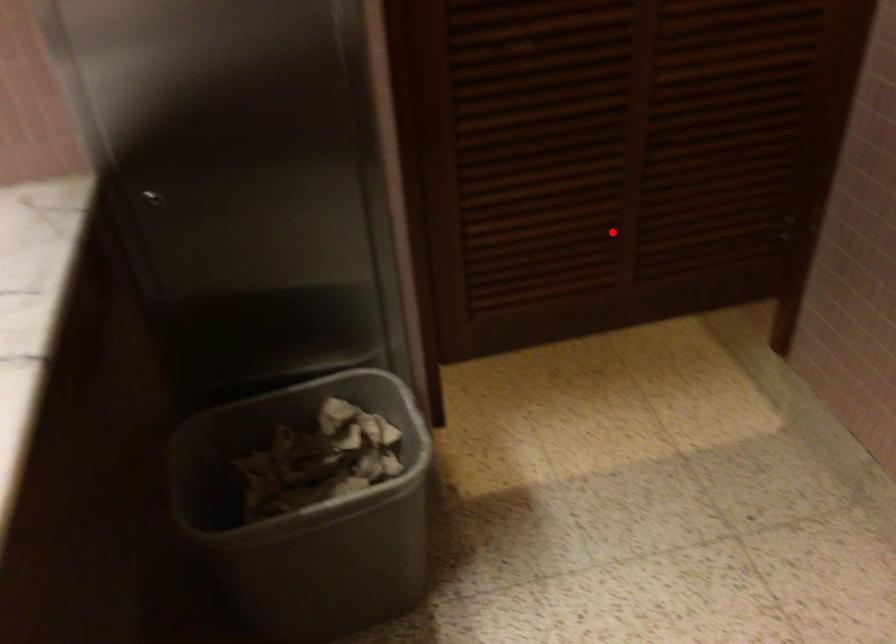
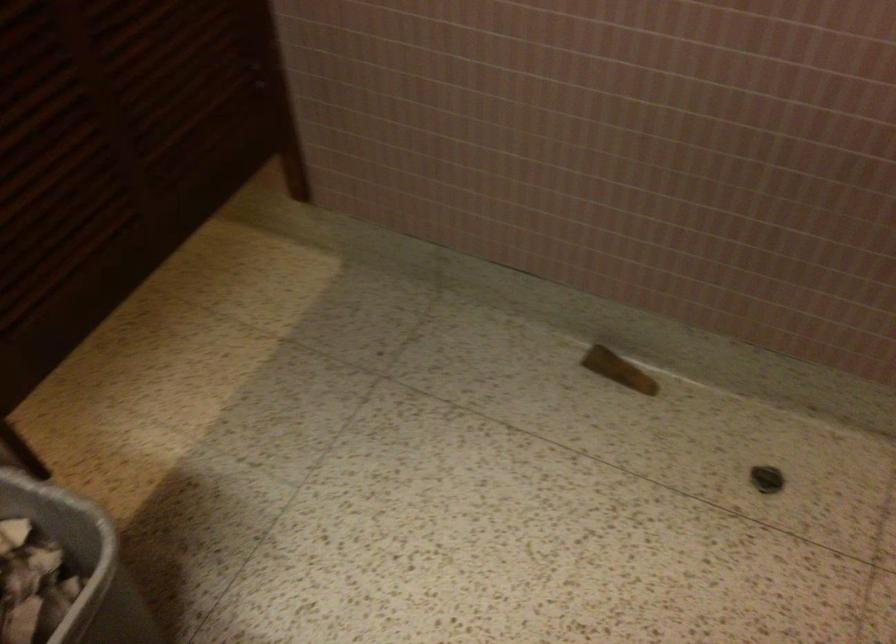
Find the pixel in the second image that matches the highlighted location in the first image.

(118, 158)